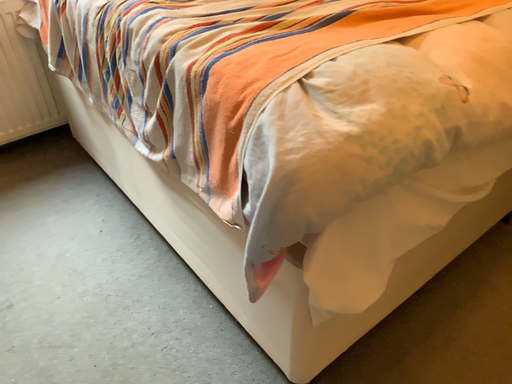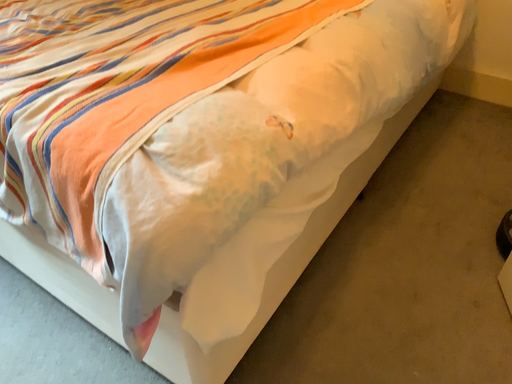
Question: Which way did the camera rotate in the video?

Choices:
 (A) rotated right
 (B) rotated left

Answer: (A)